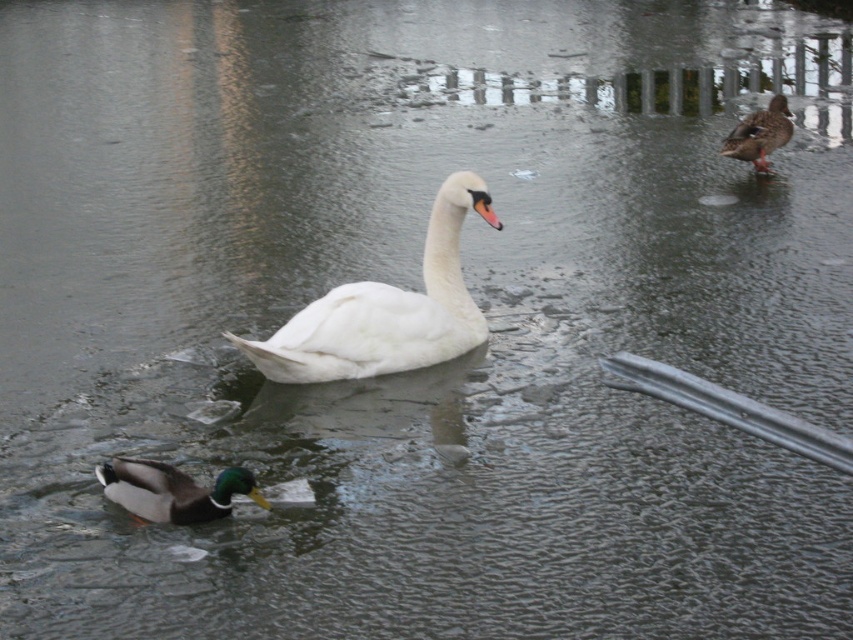
You are standing at the point with coordinates point (181, 516) and want to move towards the point with coordinates point (735, 141). Given that the terrain between them is icy and uneven, will you need to take a detour around the area between them?

Point (181, 516) is closer to the camera than point (735, 141), so moving directly towards it would require navigating a path that ascends towards the background. Since the terrain is icy and uneven, it might be safer to take a detour around the area between them to avoid potential slipping hazards.

You are a photographer trying to capture the white smooth swan at center and the brown matte duck at upper right in the same frame. Given their sizes, which one will appear bigger in your photo?

The white smooth swan at center will appear bigger in the photo because it is larger in size compared to the brown matte duck at upper right.